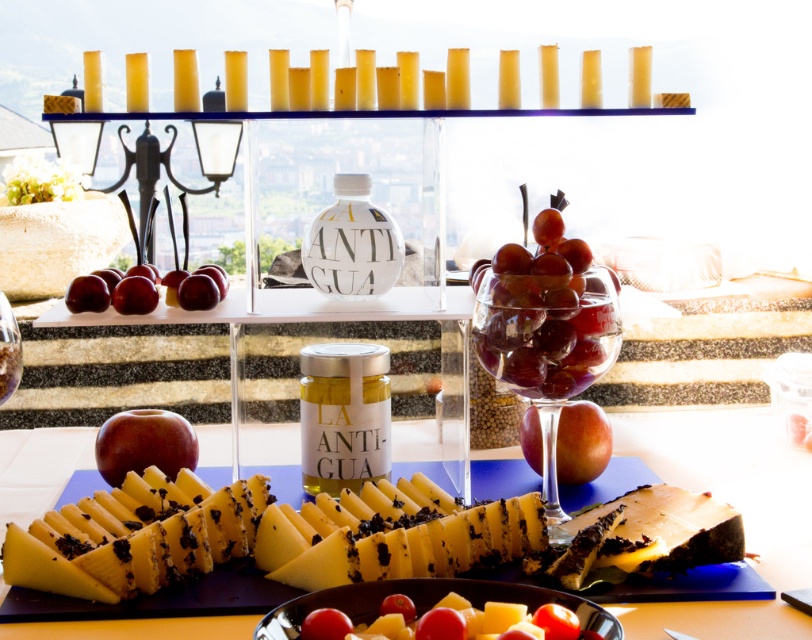
You are a food stylist arranging items on a table. You have the transparent glass grapes at center and the red matte apple at lower left. Which object is taller?

The transparent glass grapes at center are taller than the red matte apple at lower left.

You are a food stylist arranging items on a table. You have a transparent glass grapes at center and a red glossy apples at center. Which one is taller?

The transparent glass grapes at center is taller than the red glossy apples at center.

You are a guest at a dinner party and want to reach for the transparent glass grapes at center. Which direction should you move your hand relative to the plate with yellow melon slices and the wedge of aged cheese?

The transparent glass grapes at center are located at point coordinates of (547, 337). Since the plate with yellow melon slices and the wedge of aged cheese are positioned in the foreground, you should move your hand towards the center of the table to reach the transparent glass grapes at center.